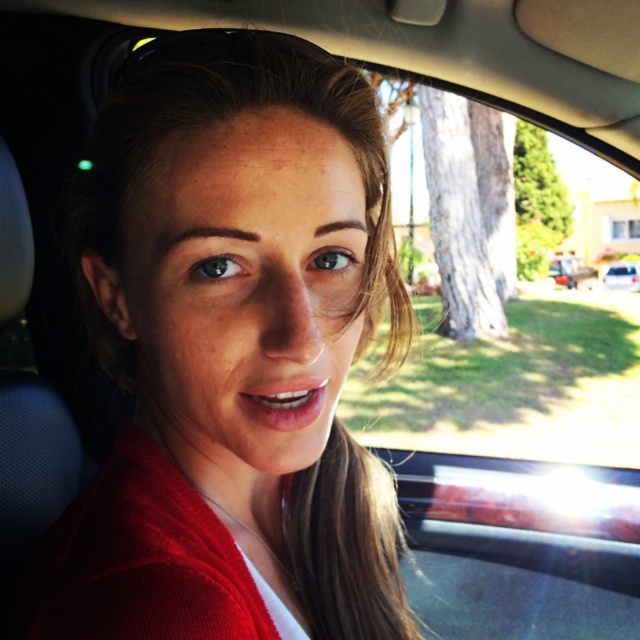
You are designing a new clothing line and want to ensure the matte red sweater at center will fit inside the metallic silver car at right. Given that the car has a storage compartment that can only accommodate items narrower than the car itself, can the sweater fit?

The matte red sweater at center has a width less than the metallic silver car at right, so it can fit inside the storage compartment.

You are a driver trying to park your car in a tight space. You see the metallic silver car at right and the white glossy car at lower right. Which car is positioned higher up in the parking spot?

The metallic silver car at right is positioned higher up in the parking spot because it is above the white glossy car at lower right.

You are a driver trying to park your car. You see the metallic silver car at right and the white glossy car at lower right. Which car is closer to the curb on the left side of the road?

The metallic silver car at right is positioned on the left side of white glossy car at lower right, so it is closer to the curb on the left side of the road.